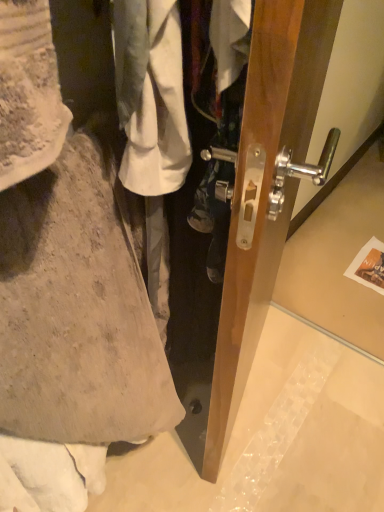
Question: Should I look upward or downward to see wooden door handle at center?

Choices:
 (A) down
 (B) up

Answer: (B)